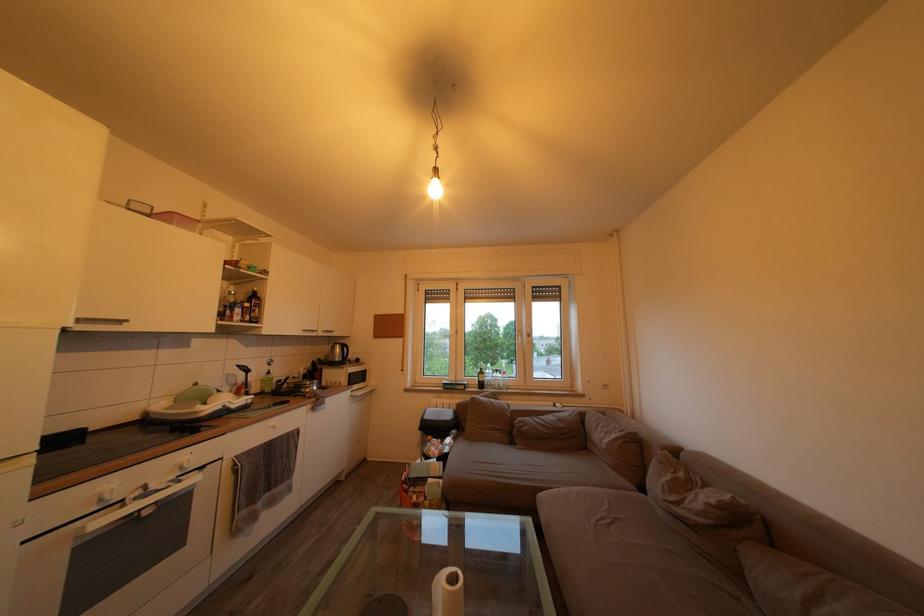
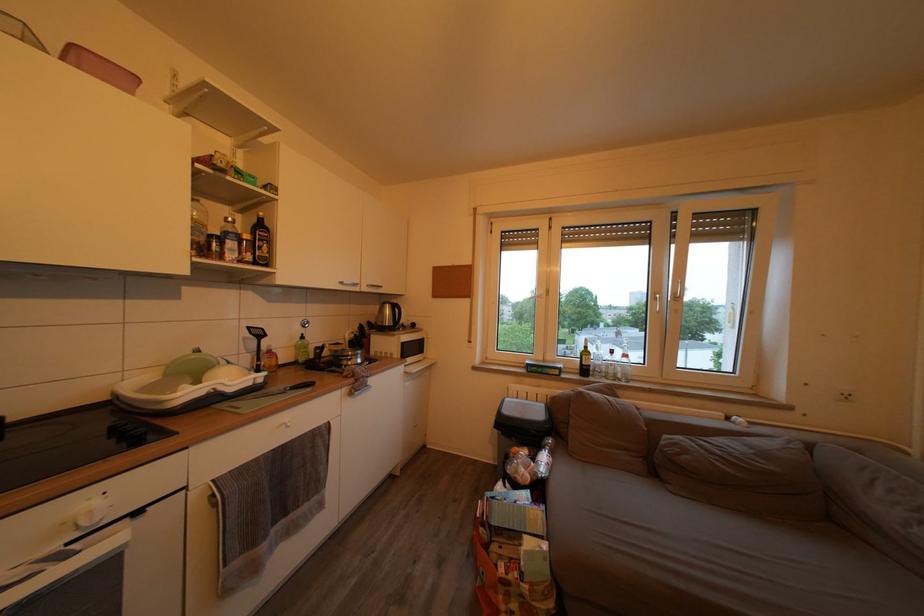
Locate, in the second image, the point that corresponds to point (283, 387) in the first image.

(320, 353)